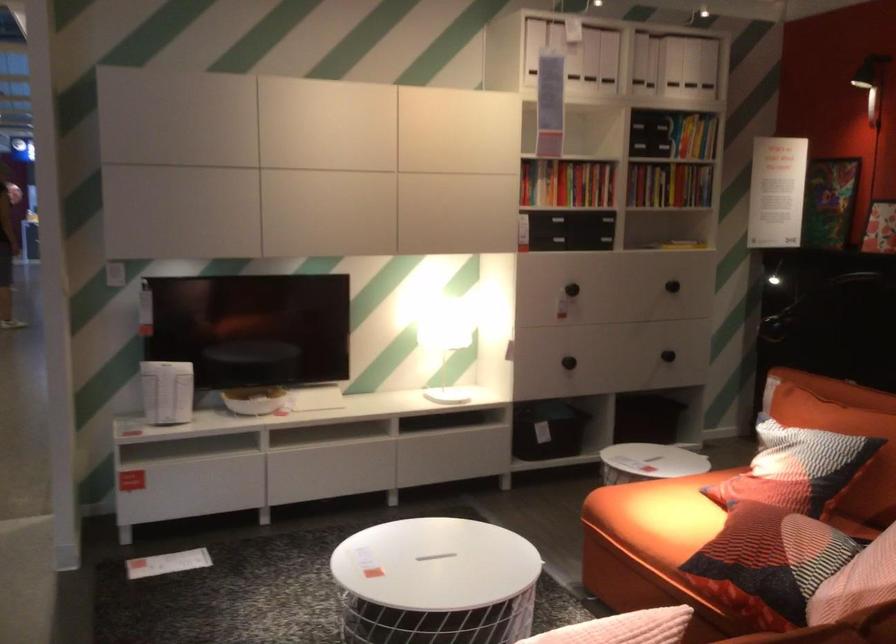
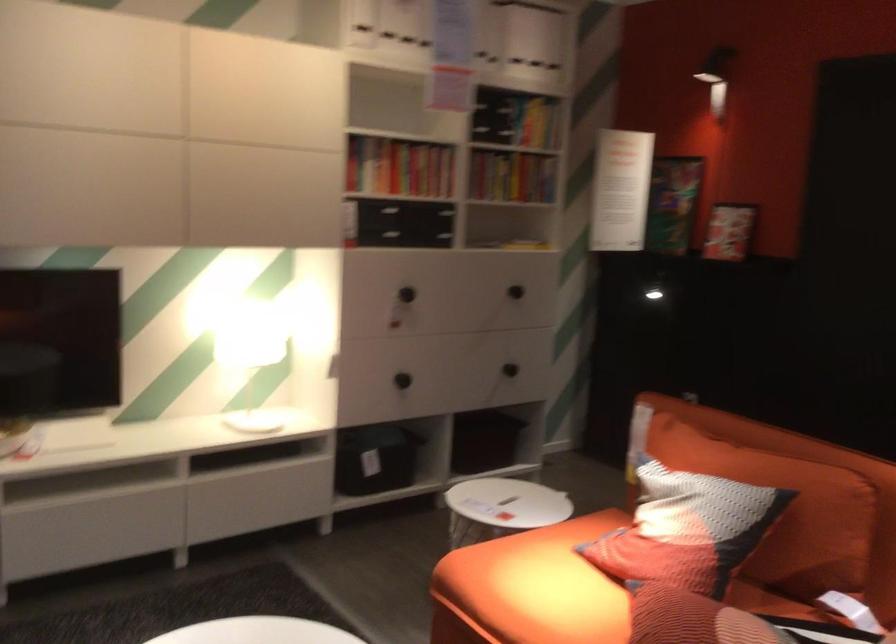
Where in the second image is the point corresponding to (x=558, y=422) from the first image?

(375, 459)